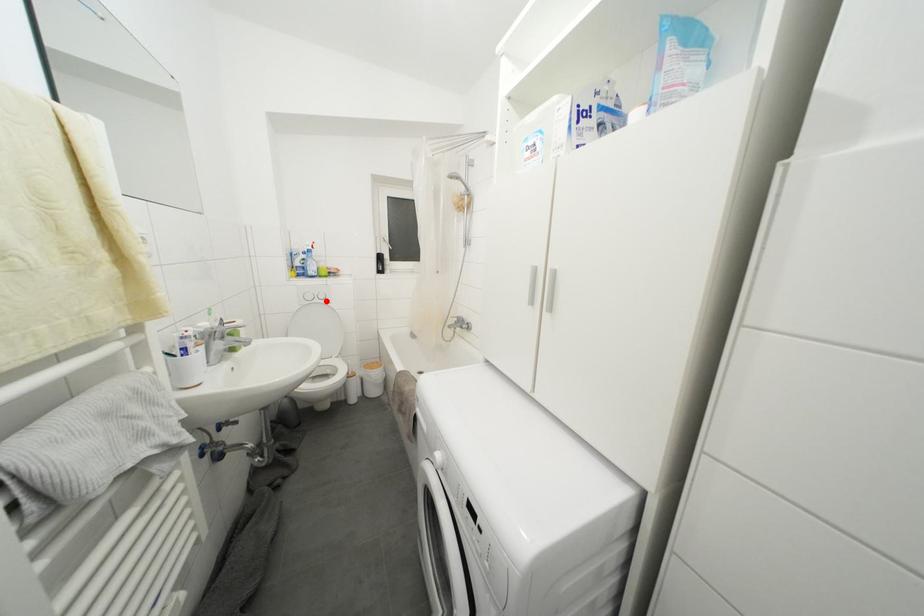
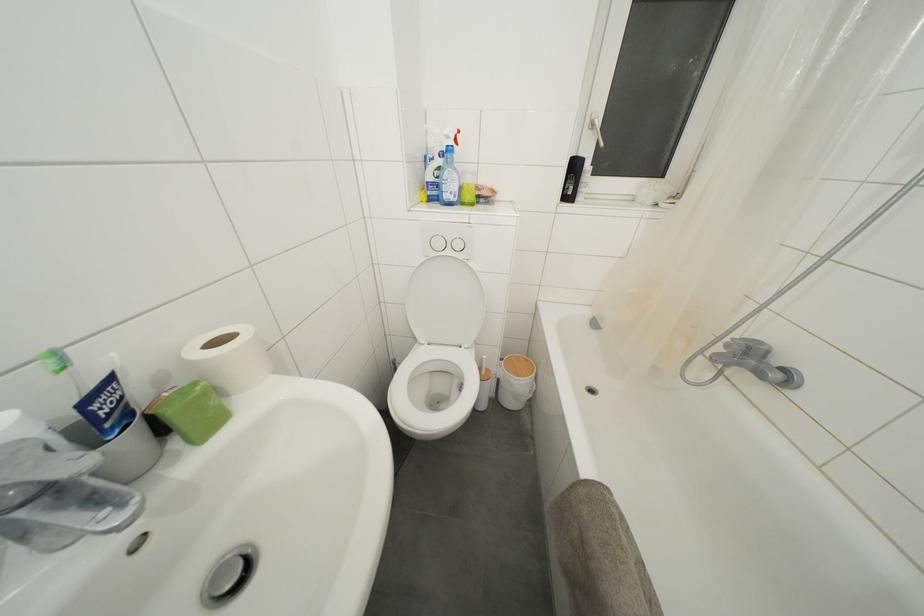
Locate, in the second image, the point that corresponds to the highlighted location in the first image.

(463, 251)